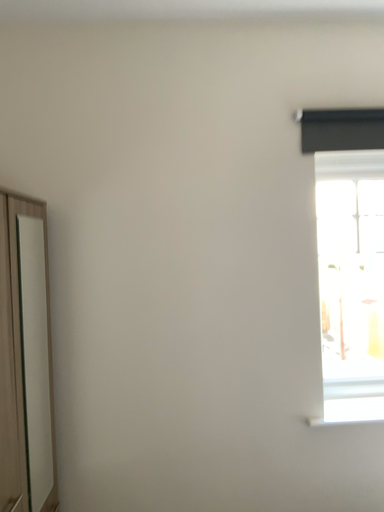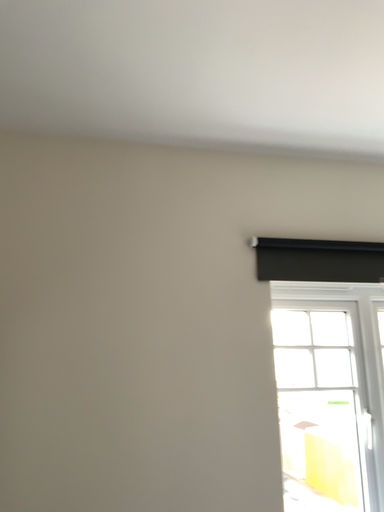
Question: How did the camera likely rotate when shooting the video?

Choices:
 (A) rotated left
 (B) rotated right

Answer: (B)